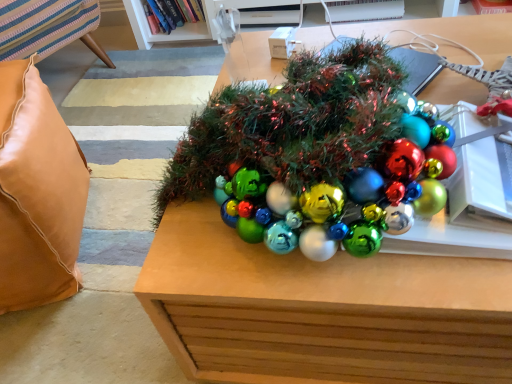
Question: In which direction should I rotate to look at metallic brown table at center, the second table in the top-to-bottom sequence?

Choices:
 (A) right
 (B) left

Answer: (A)

Question: Can you confirm if shiny green tinsel at center, arranged as the second table when ordered from the bottom, is wider than hardcover book at upper center?

Choices:
 (A) yes
 (B) no

Answer: (A)

Question: From a real-world perspective, is shiny green tinsel at center, placed as the 1th table when sorted from top to bottom, on hardcover book at upper center?

Choices:
 (A) no
 (B) yes

Answer: (B)

Question: Does shiny green tinsel at center, arranged as the second table when ordered from the bottom, have a smaller size compared to hardcover book at upper center?

Choices:
 (A) yes
 (B) no

Answer: (B)

Question: From the image's perspective, would you say shiny green tinsel at center, arranged as the second table when ordered from the bottom, is positioned over hardcover book at upper center?

Choices:
 (A) no
 (B) yes

Answer: (A)

Question: Does shiny green tinsel at center, arranged as the second table when ordered from the bottom, appear on the right side of hardcover book at upper center?

Choices:
 (A) no
 (B) yes

Answer: (B)

Question: Is shiny green tinsel at center, placed as the 1th table when sorted from top to bottom, not within hardcover book at upper center?

Choices:
 (A) yes
 (B) no

Answer: (A)

Question: Considering the relative positions of leather cushion at left and metallic brown table at center, the second table in the top-to-bottom sequence, in the image provided, is leather cushion at left to the left of metallic brown table at center, the second table in the top-to-bottom sequence, from the viewer's perspective?

Choices:
 (A) no
 (B) yes

Answer: (B)

Question: Would you say leather cushion at left is a long distance from metallic brown table at center, positioned as the 1th table in bottom-to-top order?

Choices:
 (A) yes
 (B) no

Answer: (B)

Question: From a real-world perspective, is leather cushion at left positioned under metallic brown table at center, the second table in the top-to-bottom sequence, based on gravity?

Choices:
 (A) yes
 (B) no

Answer: (B)

Question: From the image's perspective, is leather cushion at left located above metallic brown table at center, positioned as the 1th table in bottom-to-top order?

Choices:
 (A) no
 (B) yes

Answer: (A)

Question: Does leather cushion at left have a smaller size compared to metallic brown table at center, positioned as the 1th table in bottom-to-top order?

Choices:
 (A) no
 (B) yes

Answer: (B)

Question: Is the depth of leather cushion at left less than that of metallic brown table at center, positioned as the 1th table in bottom-to-top order?

Choices:
 (A) no
 (B) yes

Answer: (A)

Question: Does hardcover book at upper center have a smaller size compared to metallic brown table at center, the second table in the top-to-bottom sequence?

Choices:
 (A) no
 (B) yes

Answer: (B)